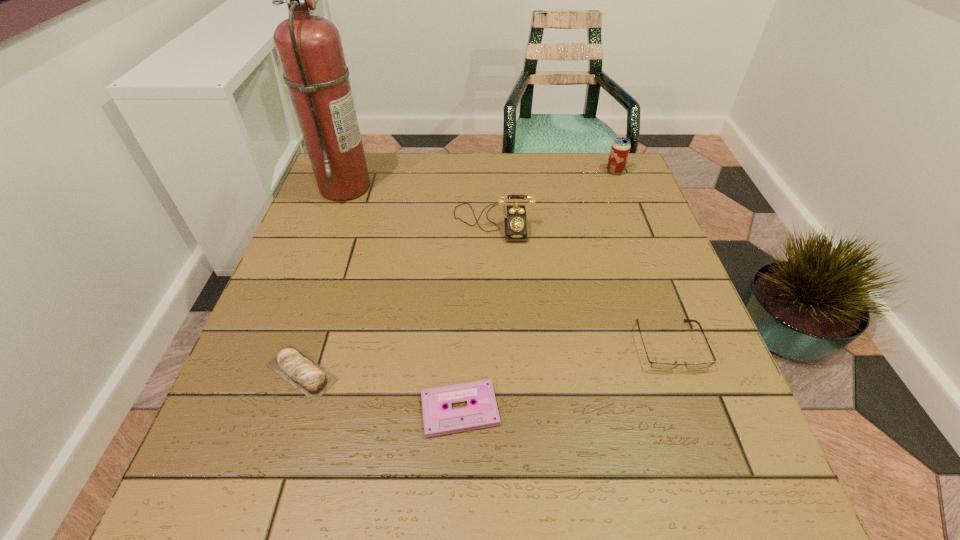
Identify the location of fire extinguisher. This screenshot has height=540, width=960. (309, 47).

Identify the location of beer can. The image size is (960, 540). (620, 148).

Locate an element on the screen. Image resolution: width=960 pixels, height=540 pixels. telephone is located at coordinates (515, 223).

Identify the location of pita bread. The width and height of the screenshot is (960, 540). (306, 375).

The image size is (960, 540). I want to click on spectacles, so click(657, 365).

What are the coordinates of `videotape` in the screenshot? It's located at (483, 413).

Find the location of a particular element. vacant region located on the front-facing side of the tallest object is located at coordinates (459, 186).

Where is `free space located 0.330m on the front of the beer can`? The height and width of the screenshot is (540, 960). free space located 0.330m on the front of the beer can is located at coordinates (646, 253).

Locate an element on the screen. free space located on the dial of the telephone is located at coordinates (497, 348).

Where is `blank area located 0.060m on the back of the pita bread`? blank area located 0.060m on the back of the pita bread is located at coordinates (319, 322).